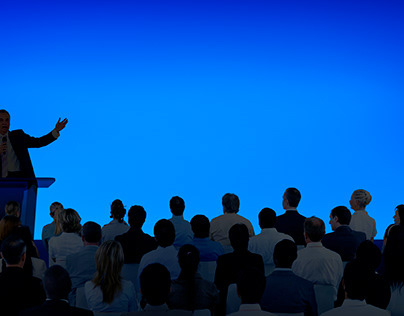
At what (x,y) coordinates should I click in order to perform the action: click on pulpit. Please return your answer as a coordinate pair (x, y). The height and width of the screenshot is (316, 404). Looking at the image, I should click on (23, 199).